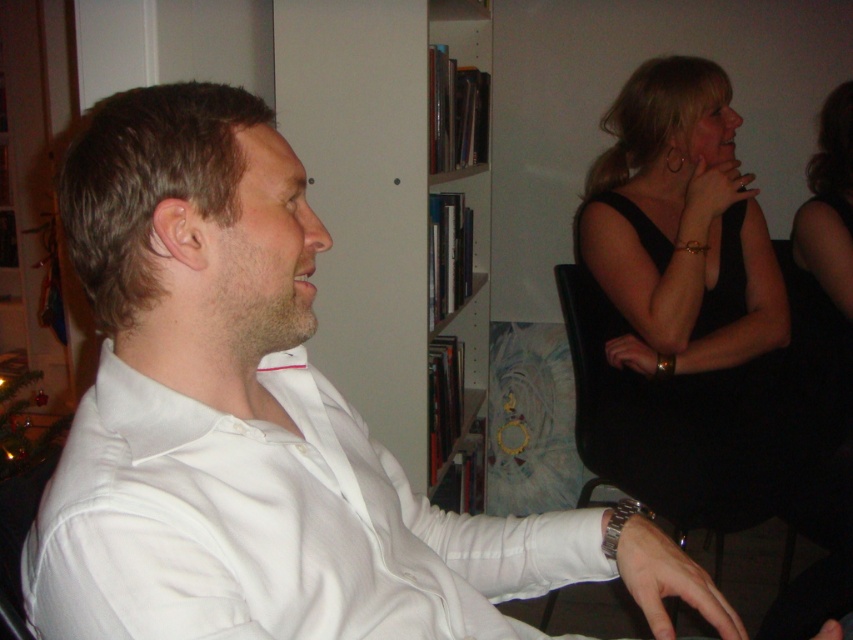
From the picture: You are an interior designer planning to place a new painting above the white glossy bookshelf at center. Based on the scene, where should the painting be placed relative to the black satin dress at upper right?

The white glossy bookshelf at center is positioned under the black satin dress at upper right, so the painting should be placed below the black satin dress at upper right to align with the bookshelf.

From the picture: You are a photographer setting up a shoot in this scene. You need to ensure that the white smooth shirt at left and the black leather chair at upper right are both visible in the frame. Which object should you position closer to the camera to maintain their visibility?

The white smooth shirt at left has a lesser height compared to the black leather chair at upper right. To maintain visibility of both, position the white smooth shirt at left closer to the camera since it is smaller in height and might be obscured by the taller black leather chair at upper right.